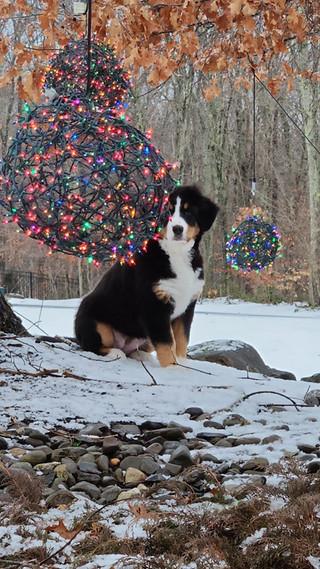
Locate an element on the screen. The height and width of the screenshot is (569, 320). white fur is located at coordinates (182, 284), (182, 288).